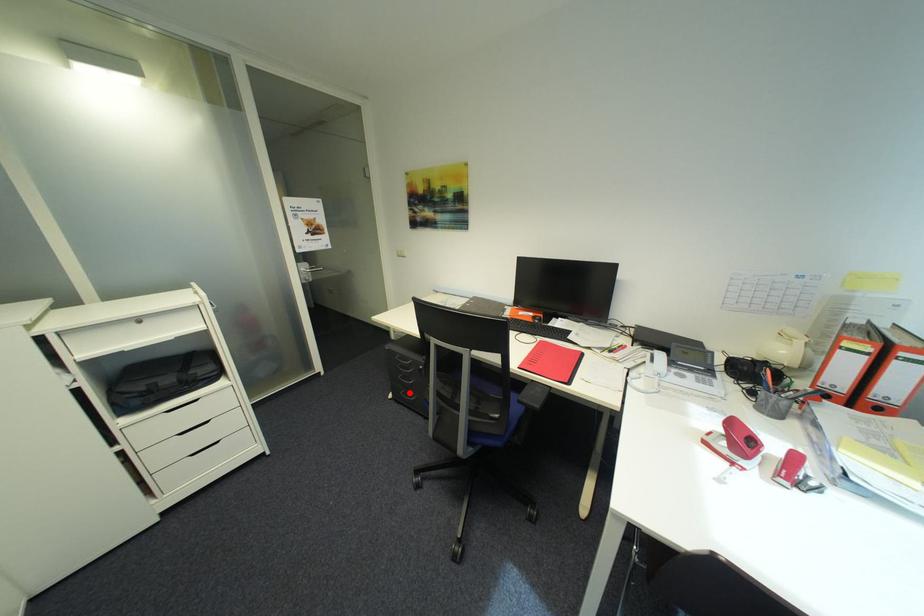
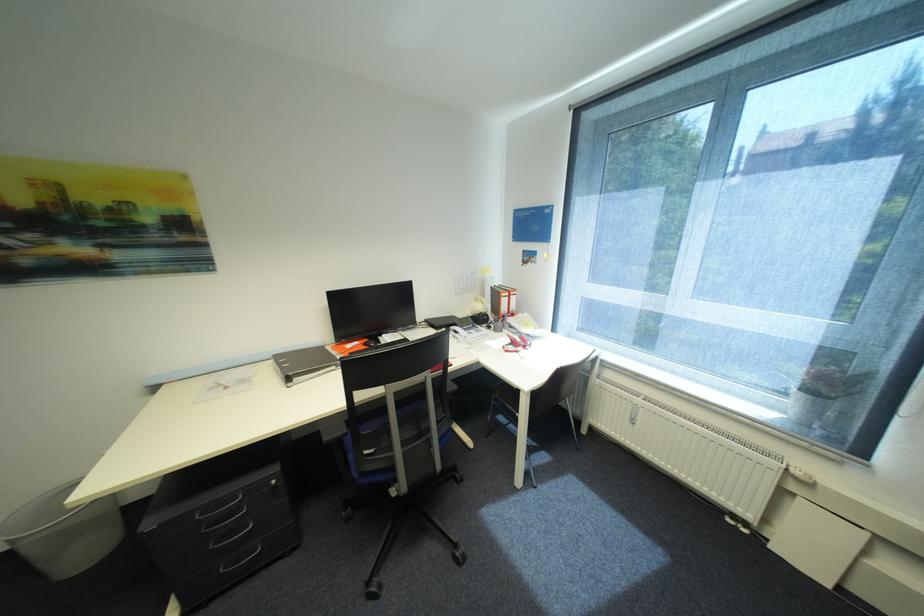
In the second image, find the point that corresponds to the highlighted location in the first image.

(229, 570)